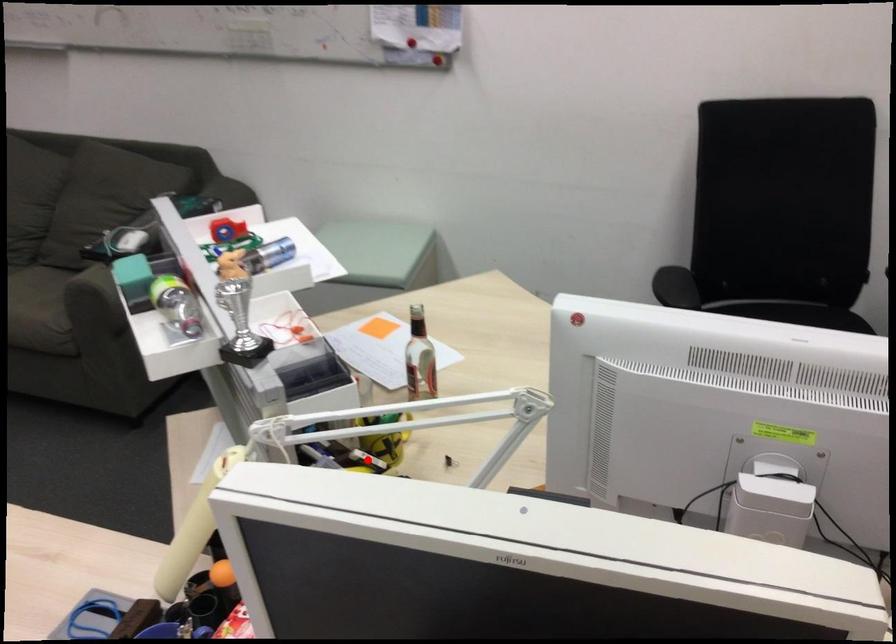
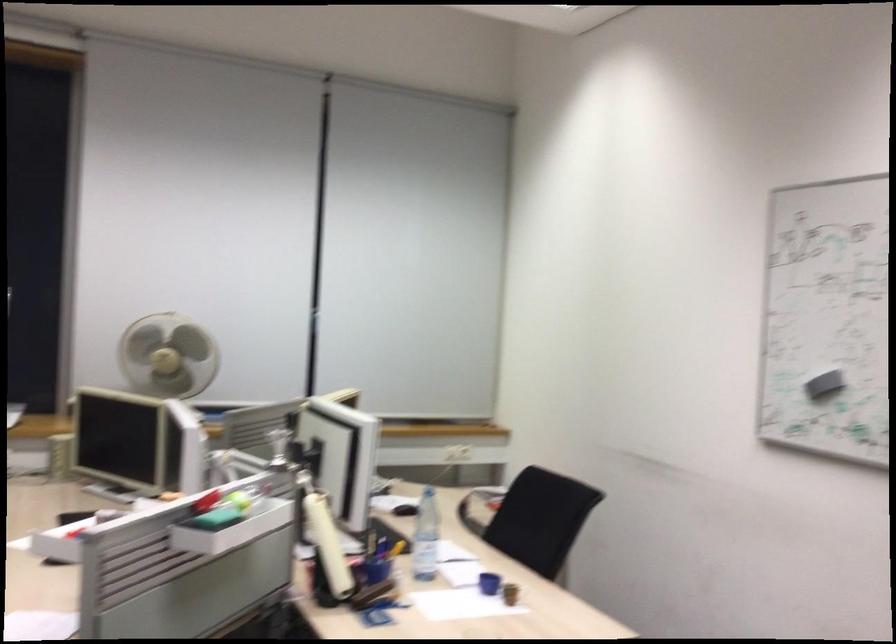
Question: I am providing you with two images of the same scene from different viewpoints. A red point is marked on the first image. Is the red point's position out of view in image 2?

Choices:
 (A) Yes
 (B) No

Answer: (A)